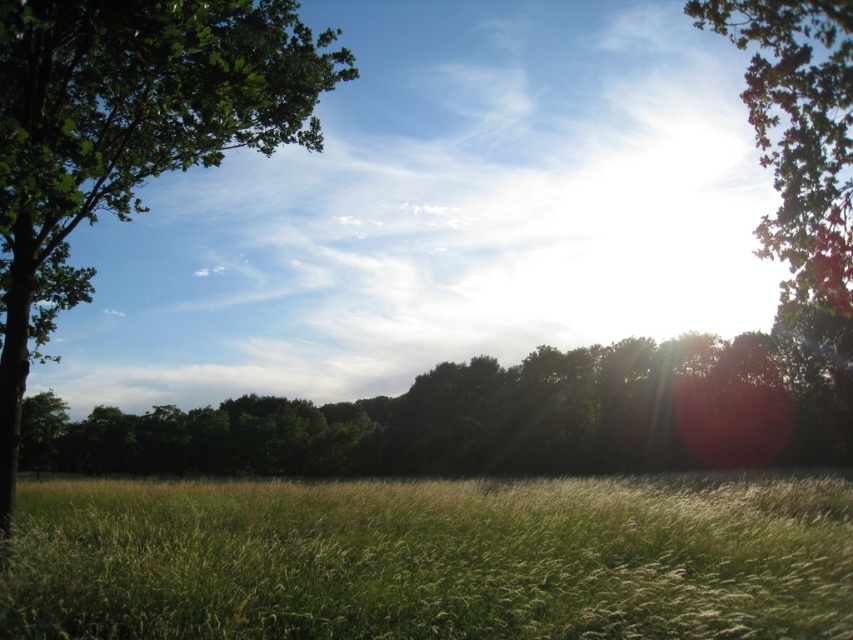
You are standing in the center of the field of tall golden grass. You want to walk towards the green leafy tree at left. In which direction should you head?

You should head towards the left direction to reach the green leafy tree at left, as it is located at point (x=126, y=132) in the scene.

You are standing in the field and want to walk from the green leafy tree at left to the green grass at center. Which direction should you face to walk directly towards your destination?

You should face the right direction because the green grass at center is positioned on the right side of green leafy tree at left.